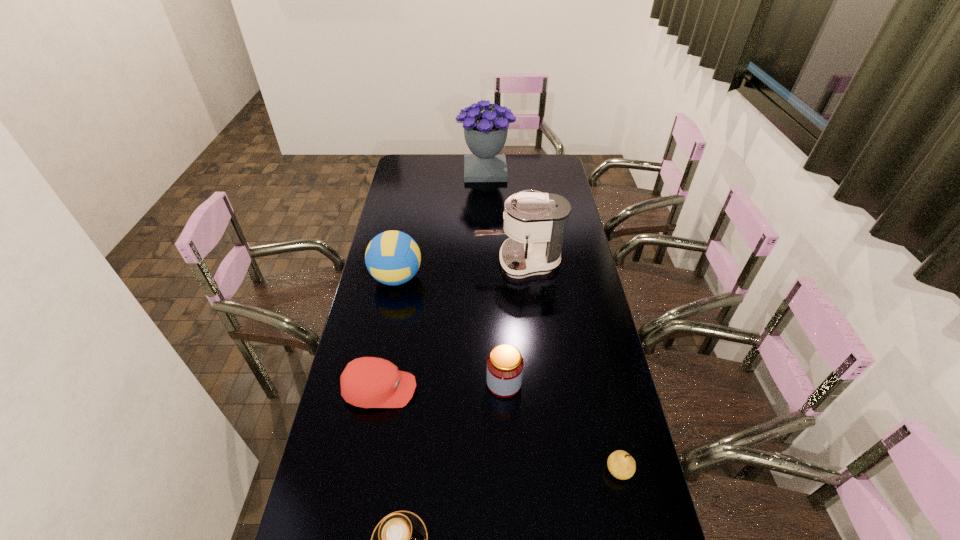
This screenshot has height=540, width=960. Find the location of `pear that is at the right edge`. pear that is at the right edge is located at coordinates (621, 465).

Locate an element on the screen. This screenshot has width=960, height=540. vacant space at the left edge of the desktop is located at coordinates (413, 183).

The width and height of the screenshot is (960, 540). Identify the location of vacant space at the right edge of the desktop. (566, 278).

Find the location of a particular element. vacant space at the far left corner is located at coordinates (401, 163).

Where is `empty space that is in between the jar and the rightmost object`? The image size is (960, 540). empty space that is in between the jar and the rightmost object is located at coordinates point(562,427).

You are a GUI agent. You are given a task and a screenshot of the screen. Output one action in this format:
    pyautogui.click(x=<x>, y=<y>)
    Task: Click on the empty space between the rightmost object and the coffee maker
    Image resolution: width=960 pixels, height=540 pixels.
    Given the screenshot: What is the action you would take?
    point(568,367)

Locate an element on the screen. This screenshot has height=540, width=960. vacant area between the rightmost object and the coffee maker is located at coordinates (568, 367).

Find the location of `free space between the cap and the jar`. free space between the cap and the jar is located at coordinates click(x=443, y=386).

Find the location of a particular element. The width and height of the screenshot is (960, 540). free space that is in between the cap and the bouquet is located at coordinates (433, 281).

Where is `free space between the third tallest object and the cap`? The height and width of the screenshot is (540, 960). free space between the third tallest object and the cap is located at coordinates (389, 334).